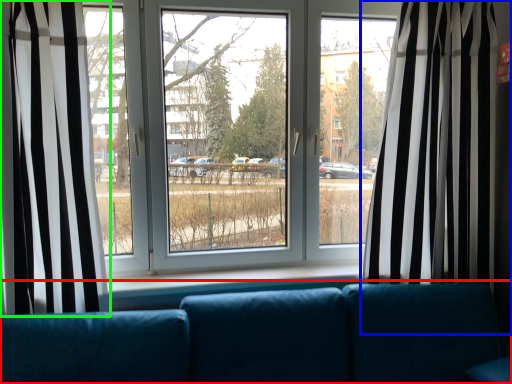
Question: Which is nearer to the studio couch (highlighted by a red box)? curtain (highlighted by a blue box) or curtain (highlighted by a green box).

Choices:
 (A) curtain
 (B) curtain

Answer: (A)